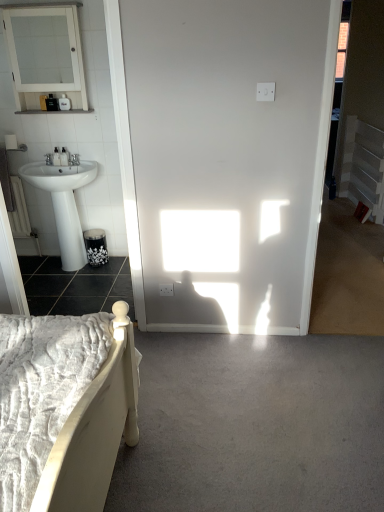
Question: Does white glossy pedestal sink at left contain white glossy medicine cabinet at upper left?

Choices:
 (A) yes
 (B) no

Answer: (B)

Question: From the image's perspective, is white glossy pedestal sink at left under white glossy medicine cabinet at upper left?

Choices:
 (A) yes
 (B) no

Answer: (A)

Question: Is white glossy pedestal sink at left at the left side of white glossy medicine cabinet at upper left?

Choices:
 (A) no
 (B) yes

Answer: (A)

Question: Is white glossy pedestal sink at left further to camera compared to white glossy medicine cabinet at upper left?

Choices:
 (A) no
 (B) yes

Answer: (B)

Question: From the image's perspective, is white glossy pedestal sink at left located above white glossy medicine cabinet at upper left?

Choices:
 (A) yes
 (B) no

Answer: (B)

Question: Are white glossy pedestal sink at left and white glossy medicine cabinet at upper left far apart?

Choices:
 (A) yes
 (B) no

Answer: (B)

Question: Is matte black soap dispenser at upper left, which is the 1th toiletry in top-to-bottom order, not close to matte black soap dispenser at left, which ranks as the second toiletry in top-to-bottom order?

Choices:
 (A) yes
 (B) no

Answer: (B)

Question: Is matte black soap dispenser at upper left, which is the 1th toiletry in top-to-bottom order, closer to camera compared to matte black soap dispenser at left, which ranks as the second toiletry in top-to-bottom order?

Choices:
 (A) yes
 (B) no

Answer: (A)

Question: Does matte black soap dispenser at upper left, which appears as the third toiletry when ordered from the bottom, have a lesser height compared to matte black soap dispenser at left, which appears as the 2th toiletry when ordered from the bottom?

Choices:
 (A) yes
 (B) no

Answer: (A)

Question: Is matte black soap dispenser at left, which appears as the 2th toiletry when ordered from the bottom, completely or partially inside matte black soap dispenser at upper left, which is the 1th toiletry in top-to-bottom order?

Choices:
 (A) yes
 (B) no

Answer: (B)

Question: Can you confirm if matte black soap dispenser at upper left, which appears as the third toiletry when ordered from the bottom, is positioned to the right of matte black soap dispenser at left, which ranks as the second toiletry in top-to-bottom order?

Choices:
 (A) yes
 (B) no

Answer: (A)

Question: Can you confirm if matte black soap dispenser at upper left, which appears as the third toiletry when ordered from the bottom, is taller than matte black soap dispenser at left, which ranks as the second toiletry in top-to-bottom order?

Choices:
 (A) yes
 (B) no

Answer: (B)

Question: Is gray carpet at lower center, marked as the 1th concrete in a front-to-back arrangement, directly adjacent to matte black soap dispenser at upper left, which is the 1th toiletry in top-to-bottom order?

Choices:
 (A) yes
 (B) no

Answer: (B)